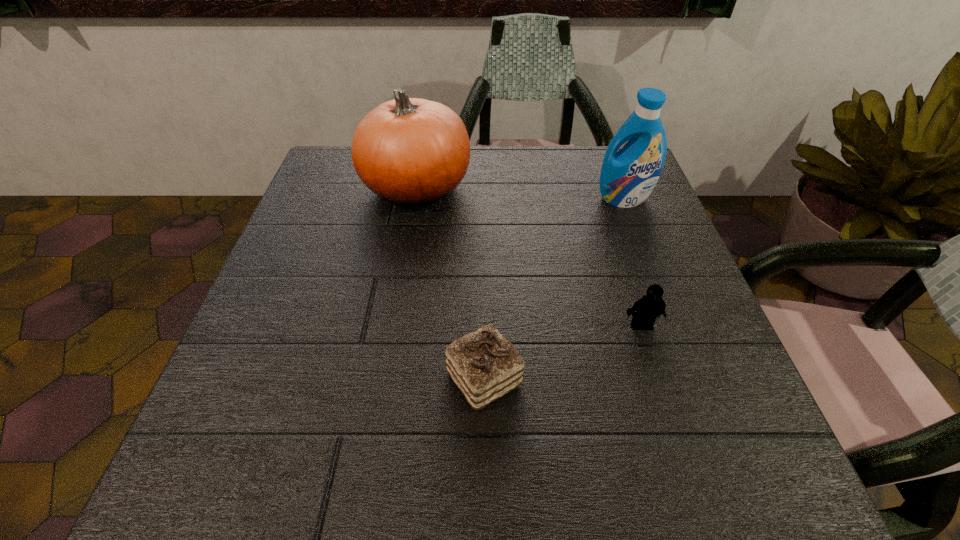
Locate an element on the screen. The height and width of the screenshot is (540, 960). detergent is located at coordinates (628, 176).

The height and width of the screenshot is (540, 960). What are the coordinates of `pumpkin` in the screenshot? It's located at (413, 152).

In order to click on Lego in this screenshot , I will do `click(651, 305)`.

Where is `the third farthest object`? The height and width of the screenshot is (540, 960). the third farthest object is located at coordinates (651, 305).

You are a GUI agent. You are given a task and a screenshot of the screen. Output one action in this format:
    pyautogui.click(x=<x>, y=<y>)
    Task: Click on the shortest object
    
    Given the screenshot: What is the action you would take?
    pyautogui.click(x=484, y=365)

Identify the location of the nearest object. The width and height of the screenshot is (960, 540). (484, 365).

Where is `vacant space situated 0.230m on the front-facing side of the detergent`? The image size is (960, 540). vacant space situated 0.230m on the front-facing side of the detergent is located at coordinates (654, 280).

Image resolution: width=960 pixels, height=540 pixels. In order to click on free space located 0.200m on the front of the pumpkin in this screenshot , I will do `click(398, 288)`.

Locate an element on the screen. This screenshot has height=540, width=960. free space located 0.050m on the face of the second nearest object is located at coordinates (651, 355).

Find the location of a particular element. vacant position located on the right of the nearest object is located at coordinates (734, 378).